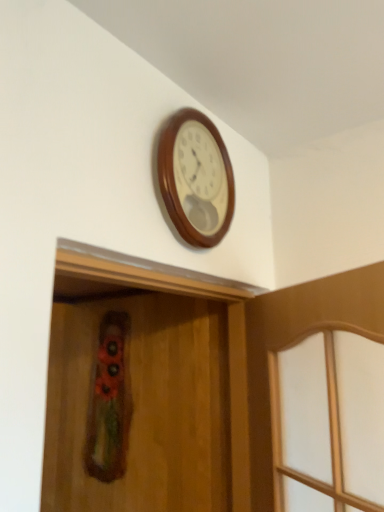
Where is `wooden screen door at center`? wooden screen door at center is located at coordinates 137,405.

This screenshot has height=512, width=384. Describe the element at coordinates (137, 405) in the screenshot. I see `wooden screen door at center` at that location.

What is the approximate height of wooden screen door at center?

It is 73.19 centimeters.

Describe the element at coordinates (196, 178) in the screenshot. I see `wooden clock at upper center` at that location.

Measure the distance between point (172, 186) and camera.

Point (172, 186) is 1.08 meters away from camera.

Where is `wooden clock at upper center`? This screenshot has width=384, height=512. wooden clock at upper center is located at coordinates (196, 178).

Locate an element on the screen. Image resolution: width=384 pixels, height=512 pixels. wooden screen door at center is located at coordinates (137, 405).

Which object is positioned more to the left, wooden screen door at center or wooden clock at upper center?

Positioned to the left is wooden screen door at center.

Relative to wooden clock at upper center, is wooden screen door at center in front or behind?

Clearly, wooden screen door at center is in front of wooden clock at upper center.

Is point (154, 436) positioned before point (162, 143)?

No, it is behind (162, 143).

From the image's perspective, is wooden screen door at center above or below wooden clock at upper center?

From the image's perspective, wooden screen door at center appears below wooden clock at upper center.

From a real-world perspective, between wooden screen door at center and wooden clock at upper center, who is vertically lower?

wooden screen door at center is physically lower.

Considering the relative sizes of wooden screen door at center and wooden clock at upper center in the image provided, is wooden screen door at center wider than wooden clock at upper center?

Correct, the width of wooden screen door at center exceeds that of wooden clock at upper center.

Who is shorter, wooden screen door at center or wooden clock at upper center?

Standing shorter between the two is wooden clock at upper center.

Does wooden screen door at center have a larger size compared to wooden clock at upper center?

Yes.

Is wooden screen door at center inside the boundaries of wooden clock at upper center, or outside?

wooden screen door at center is spatially situated outside wooden clock at upper center.

Is wooden screen door at center not near wooden clock at upper center?

No, there isn't a large distance between wooden screen door at center and wooden clock at upper center.

Consider the image. Is wooden screen door at center facing away from wooden clock at upper center?

No.

At what (x,y) coordinates should I click in order to perform the action: click on wall clock behind the wooden screen door at center. Please return your answer as a coordinate pair (x, y). The image size is (384, 512). Looking at the image, I should click on (196, 178).

Does wooden clock at upper center appear on the left side of wooden screen door at center?

In fact, wooden clock at upper center is to the right of wooden screen door at center.

Between wooden clock at upper center and wooden screen door at center, which one is positioned behind?

wooden clock at upper center is further away from the camera.

From the picture: Which point is more distant from viewer, (175, 136) or (145, 407)?

Point (145, 407)

From the image's perspective, which object appears higher, wooden clock at upper center or wooden screen door at center?

wooden clock at upper center is shown above in the image.

From a real-world perspective, between wooden clock at upper center and wooden screen door at center, who is vertically lower?

In real-world perspective, wooden screen door at center is lower.

Is wooden clock at upper center wider or thinner than wooden screen door at center?

Considering their sizes, wooden clock at upper center looks slimmer than wooden screen door at center.

Between wooden clock at upper center and wooden screen door at center, which one has less height?

Standing shorter between the two is wooden clock at upper center.

Which of these two, wooden clock at upper center or wooden screen door at center, is bigger?

wooden screen door at center is bigger.

Do you think wooden clock at upper center is within wooden screen door at center, or outside of it?

wooden clock at upper center is outside wooden screen door at center.

Can you see wooden clock at upper center touching wooden screen door at center?

No, wooden clock at upper center is not with wooden screen door at center.

Is wooden clock at upper center oriented away from wooden screen door at center?

That's not correct — wooden clock at upper center is not looking away from wooden screen door at center.

How different are the orientations of wooden clock at upper center and wooden screen door at center in degrees?

There is a 1.89-degree angle between the facing directions of wooden clock at upper center and wooden screen door at center.

Locate an element on the screen. The width and height of the screenshot is (384, 512). wall clock that is behind the wooden screen door at center is located at coordinates (196, 178).

The image size is (384, 512). Find the location of `screen door that is below the wooden clock at upper center (from the image's perspective)`. screen door that is below the wooden clock at upper center (from the image's perspective) is located at coordinates (137, 405).

Image resolution: width=384 pixels, height=512 pixels. Find the location of `wall clock above the wooden screen door at center (from the image's perspective)`. wall clock above the wooden screen door at center (from the image's perspective) is located at coordinates (196, 178).